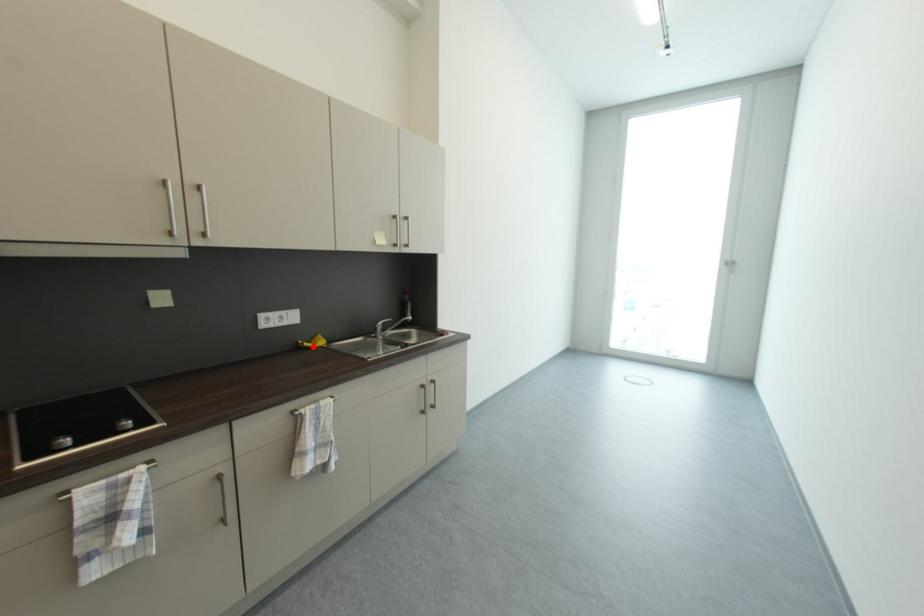
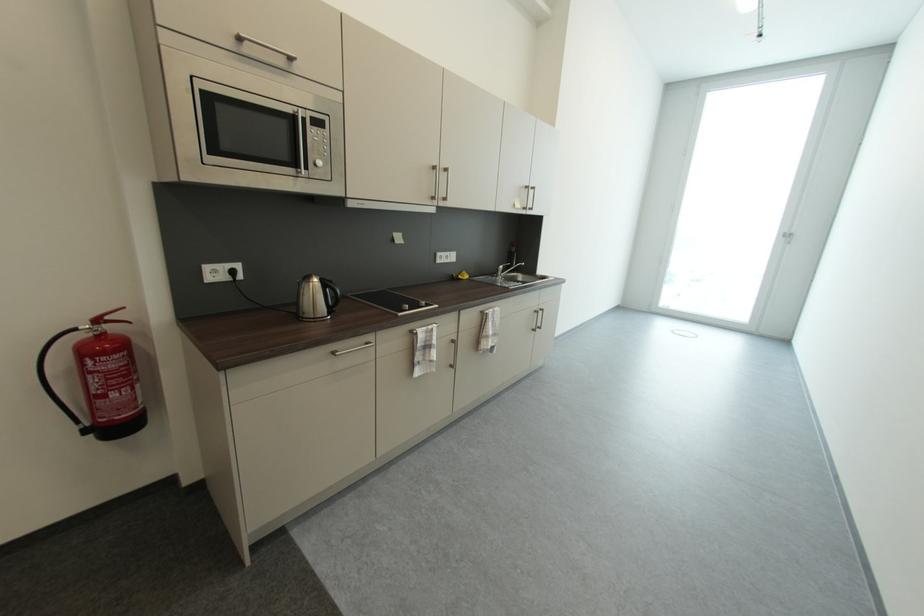
In the second image, find the point that corresponds to the highlighted location in the first image.

(467, 278)